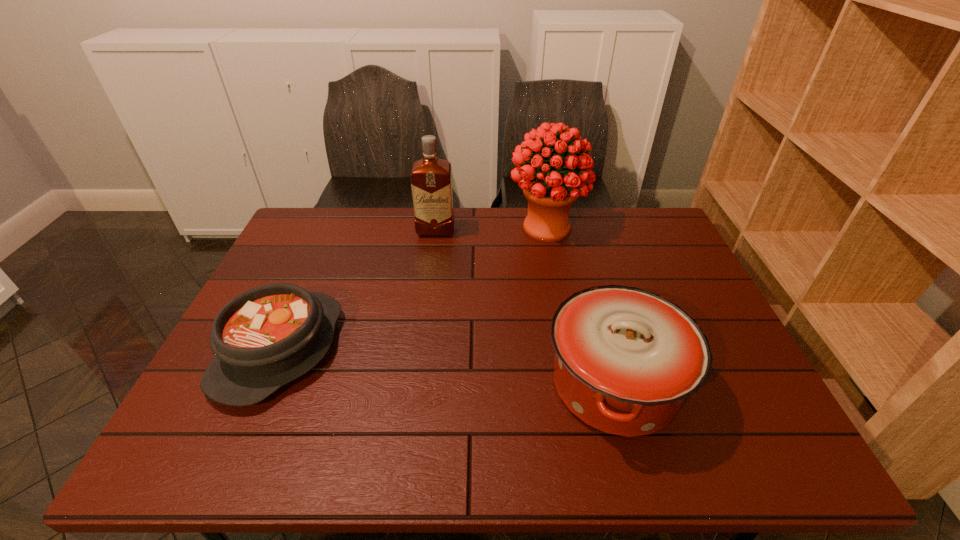
The width and height of the screenshot is (960, 540). What are the coordinates of `bouquet positioned at the far edge` in the screenshot? It's located at (550, 194).

The image size is (960, 540). I want to click on liquor positioned at the far edge, so click(x=431, y=178).

The image size is (960, 540). In order to click on object present at the near edge in this screenshot , I will do `click(626, 359)`.

The height and width of the screenshot is (540, 960). Identify the location of object located at the left edge. (264, 338).

The width and height of the screenshot is (960, 540). I want to click on object located at the right edge, so click(626, 359).

Locate an element on the screen. This screenshot has height=540, width=960. object that is at the near right corner is located at coordinates (626, 359).

Find the location of `vacant space at the far edge of the desktop`. vacant space at the far edge of the desktop is located at coordinates (583, 247).

Where is `free space at the near edge`? free space at the near edge is located at coordinates (680, 454).

Where is `vacant region at the left edge of the desktop`? vacant region at the left edge of the desktop is located at coordinates (289, 276).

The width and height of the screenshot is (960, 540). I want to click on free spot between the bouquet and the left casserole, so click(413, 288).